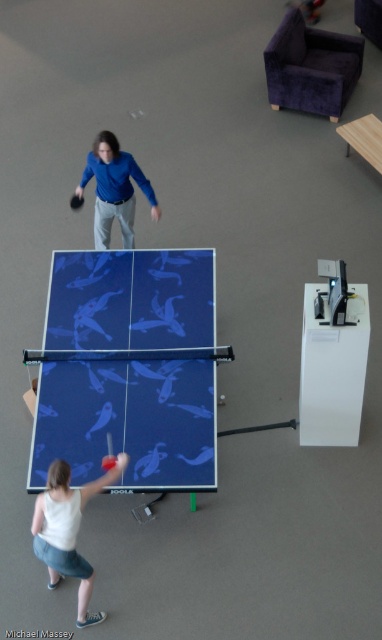
Is blue rubber table tennis table at center to the right of white fabric shirt at lower left from the viewer's perspective?

Indeed, blue rubber table tennis table at center is positioned on the right side of white fabric shirt at lower left.

Consider the image. Can you confirm if blue rubber table tennis table at center is taller than white fabric shirt at lower left?

Yes, blue rubber table tennis table at center is taller than white fabric shirt at lower left.

At what (x,y) coordinates should I click in order to perform the action: click on blue rubber table tennis table at center. Please return your answer as a coordinate pair (x, y). This screenshot has width=382, height=640. Looking at the image, I should click on (129, 420).

Can you confirm if white fabric shirt at lower left is positioned to the right of black rubber paddle at upper left?

Correct, you'll find white fabric shirt at lower left to the right of black rubber paddle at upper left.

Is white fabric shirt at lower left above black rubber paddle at upper left?

No.

Is point (85, 602) closer to camera compared to point (77, 205)?

Yes, it is in front of point (77, 205).

At what (x,y) coordinates should I click in order to perform the action: click on white fabric shirt at lower left. Please return your answer as a coordinate pair (x, y). Looking at the image, I should click on (67, 531).

How much distance is there between white fabric shirt at lower left and red rubber table tennis racket at lower left?

19.30 inches

What do you see at coordinates (67, 531) in the screenshot? The height and width of the screenshot is (640, 382). I see `white fabric shirt at lower left` at bounding box center [67, 531].

Describe the element at coordinates (67, 531) in the screenshot. I see `white fabric shirt at lower left` at that location.

Find the location of a particular element. The image size is (382, 640). white fabric shirt at lower left is located at coordinates (67, 531).